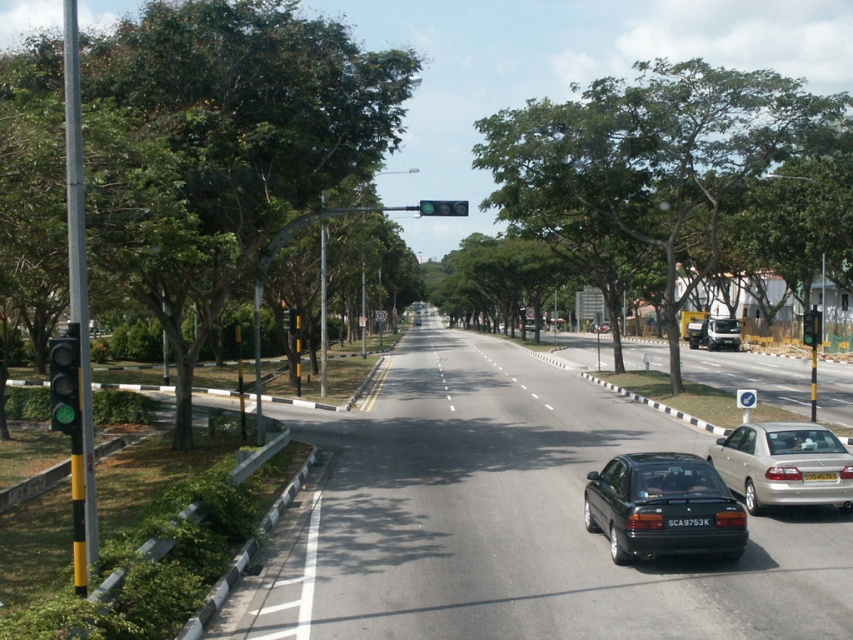
Which is behind, point (457, 205) or point (822, 474)?

Positioned behind is point (457, 205).

Is point (439, 208) positioned behind point (827, 472)?

Yes, it is.

Is point (454, 202) positioned behind point (808, 477)?

Yes, point (454, 202) is farther from viewer.

At what (x,y) coordinates should I click in order to perform the action: click on green matte traffic light at center. Please return your answer as a coordinate pair (x, y). Image resolution: width=853 pixels, height=640 pixels. Looking at the image, I should click on (442, 208).

Who is lower down, green glass traffic light at left or green glass traffic light at center?

green glass traffic light at left is below.

Which is more to the right, green glass traffic light at left or green glass traffic light at center?

green glass traffic light at center is more to the right.

Is point (70, 365) positioned in front of point (804, 340)?

Yes, point (70, 365) is in front of point (804, 340).

Locate an element on the screen. The width and height of the screenshot is (853, 640). green glass traffic light at left is located at coordinates (64, 384).

Looking at this image, measure the distance between point [804,317] and camera.

A distance of 20.55 meters exists between point [804,317] and camera.

Can you confirm if green glass traffic light at center is positioned above black plastic license plate at center?

Correct, green glass traffic light at center is located above black plastic license plate at center.

Identify the location of green glass traffic light at center. (811, 326).

I want to click on green glass traffic light at center, so coord(811,326).